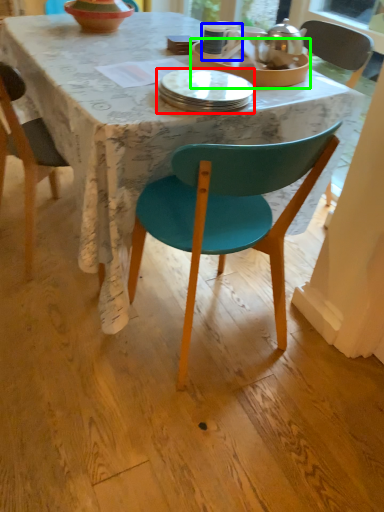
Question: Which is nearer to the plate (highlighted by a red box)? coffee cup (highlighted by a blue box) or tableware (highlighted by a green box).

Choices:
 (A) coffee cup
 (B) tableware

Answer: (B)